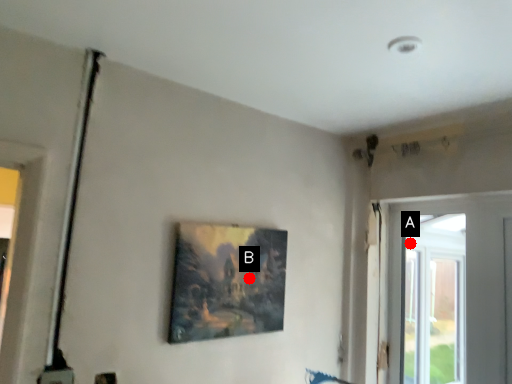
Question: Two points are circled on the image, labeled by A and B beside each circle. Which point is closer to the camera?

Choices:
 (A) A is closer
 (B) B is closer

Answer: (B)